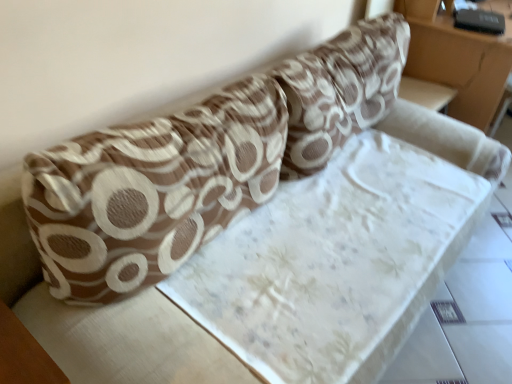
Question: Does floral fabric mattress at upper right lie behind brown textured pillow at upper center, the 2th throw pillow positioned from the right?

Choices:
 (A) no
 (B) yes

Answer: (B)

Question: Considering the relative positions of floral fabric mattress at upper right and brown textured pillow at upper center, which is the first throw pillow in left-to-right order, in the image provided, is floral fabric mattress at upper right to the left of brown textured pillow at upper center, which is the first throw pillow in left-to-right order, from the viewer's perspective?

Choices:
 (A) yes
 (B) no

Answer: (B)

Question: Can you see floral fabric mattress at upper right touching brown textured pillow at upper center, the 2th throw pillow positioned from the right?

Choices:
 (A) no
 (B) yes

Answer: (A)

Question: Is floral fabric mattress at upper right smaller than brown textured pillow at upper center, which is the first throw pillow in left-to-right order?

Choices:
 (A) yes
 (B) no

Answer: (B)

Question: Is floral fabric mattress at upper right completely or partially outside of brown textured pillow at upper center, which is the first throw pillow in left-to-right order?

Choices:
 (A) no
 (B) yes

Answer: (B)

Question: Can you confirm if floral fabric mattress at upper right is shorter than brown textured pillow at upper center, the 2th throw pillow positioned from the right?

Choices:
 (A) yes
 (B) no

Answer: (B)

Question: Are brown textured pillow at upper center, which is the first throw pillow in left-to-right order, and brown textured pillow at upper center, the 2th throw pillow positioned from the left, far apart?

Choices:
 (A) yes
 (B) no

Answer: (B)

Question: Can you confirm if brown textured pillow at upper center, which is the first throw pillow in left-to-right order, is positioned to the left of brown textured pillow at upper center, the 2th throw pillow positioned from the left?

Choices:
 (A) yes
 (B) no

Answer: (A)

Question: Considering the relative sizes of brown textured pillow at upper center, which is the first throw pillow in left-to-right order, and brown textured pillow at upper center, placed as the first throw pillow when sorted from right to left, in the image provided, is brown textured pillow at upper center, which is the first throw pillow in left-to-right order, wider than brown textured pillow at upper center, placed as the first throw pillow when sorted from right to left,?

Choices:
 (A) no
 (B) yes

Answer: (A)

Question: From a real-world perspective, is brown textured pillow at upper center, the 2th throw pillow positioned from the right, on top of brown textured pillow at upper center, the 2th throw pillow positioned from the left?

Choices:
 (A) yes
 (B) no

Answer: (B)

Question: Is brown textured pillow at upper center, which is the first throw pillow in left-to-right order, closer to camera compared to brown textured pillow at upper center, placed as the first throw pillow when sorted from right to left?

Choices:
 (A) yes
 (B) no

Answer: (A)

Question: Can you confirm if brown textured pillow at upper center, the 2th throw pillow positioned from the right, is smaller than brown textured pillow at upper center, placed as the first throw pillow when sorted from right to left?

Choices:
 (A) no
 (B) yes

Answer: (B)

Question: Would you say white fabric table at lower left contains brown textured pillow at upper center, which is the first throw pillow in left-to-right order?

Choices:
 (A) yes
 (B) no

Answer: (B)